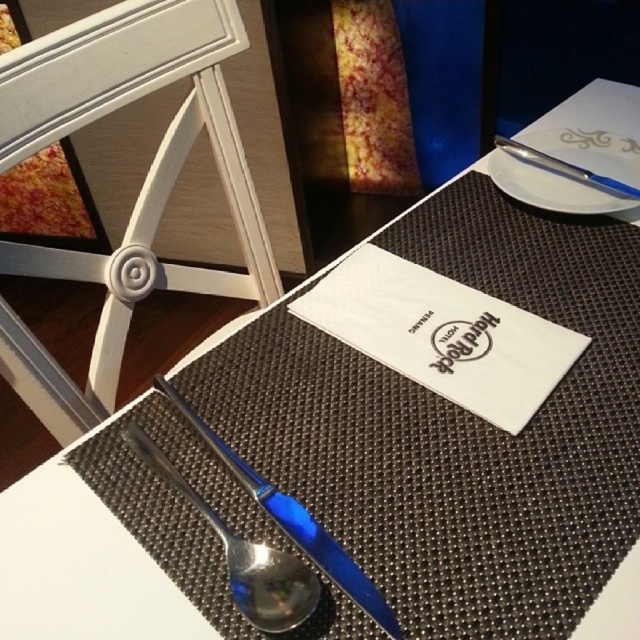
You are a waiter at the Hard Rock Hotel and need to place a blue plastic spoon at center at the exact coordinates point (243, 556) on the table. The table has a dark brown placemat with a grid pattern. Where should you place the blue plastic spoon at center?

The blue plastic spoon at center should be placed at the coordinates point (243, 556) on the dark brown placemat with a grid pattern.

You are a server at the Hard Rock Hotel and need to place a drink coaster between the blue plastic spoon at center and the blue polished spoon at center. The coaster has a diameter of 1.5 inches. Will there be enough space between them to fit the coaster?

The blue plastic spoon at center is 1.40 inches away from blue polished spoon at center. Since the coaster has a diameter of 1.5 inches, which is larger than the space between them, the coaster cannot fit between them.